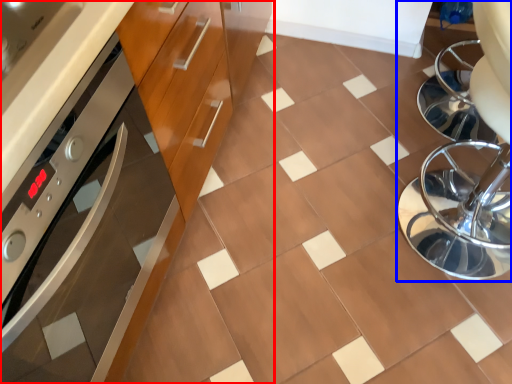
Question: Which of the following is the farthest to the observer, cabinetry (highlighted by a red box) or swivel chair (highlighted by a blue box)?

Choices:
 (A) cabinetry
 (B) swivel chair

Answer: (B)